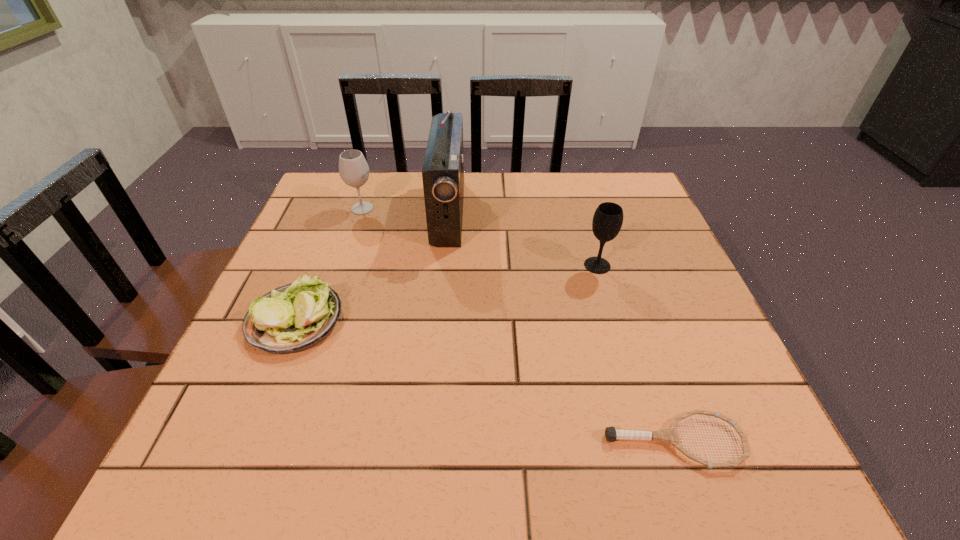
This screenshot has height=540, width=960. Identify the location of the third object from right to left. (443, 170).

Locate an element on the screen. This screenshot has width=960, height=540. the tallest object is located at coordinates (443, 170).

Where is `the farther wineglass`? The image size is (960, 540). the farther wineglass is located at coordinates (353, 169).

Find the location of a particular element. the nearer wineglass is located at coordinates (607, 221).

Identify the location of the third nearest object. The width and height of the screenshot is (960, 540). (607, 221).

The height and width of the screenshot is (540, 960). I want to click on the fourth farthest object, so click(x=289, y=319).

What are the coordinates of `lettuce` in the screenshot? It's located at (289, 319).

You are a GUI agent. You are given a task and a screenshot of the screen. Output one action in this format:
    pyautogui.click(x=<x>, y=<y>)
    Task: Click on the tennis racket
    This screenshot has width=960, height=540.
    Given the screenshot: What is the action you would take?
    pyautogui.click(x=669, y=435)

Identify the location of the nearest object. This screenshot has width=960, height=540. (669, 435).

At what (x,y) coordinates should I click in order to perform the action: click on vacant region located 0.220m on the front-facing side of the third object from right to left. Please return your answer as a coordinate pair (x, y). Image resolution: width=960 pixels, height=540 pixels. Looking at the image, I should click on (547, 213).